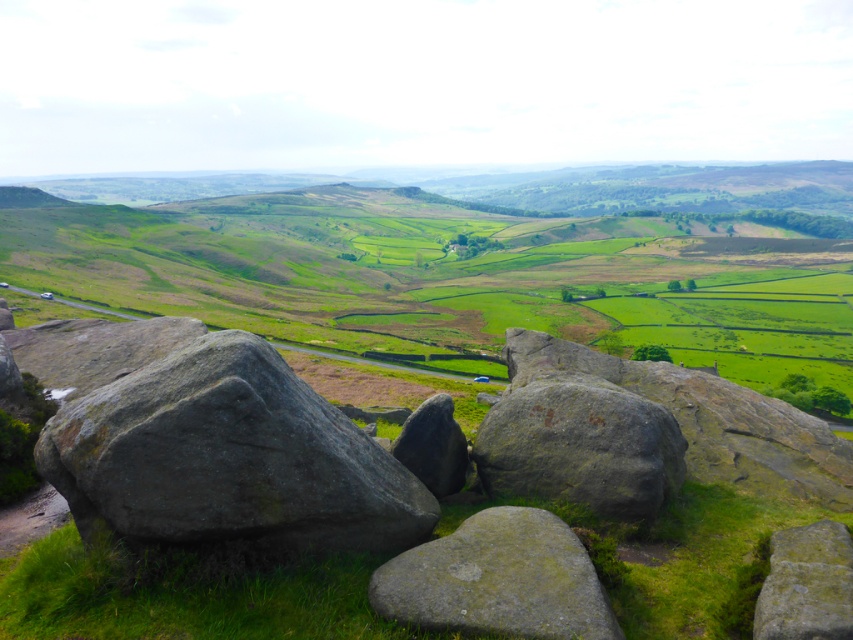
Question: Can you confirm if green mossy rock at center is thinner than green mossy rock at lower right?

Choices:
 (A) no
 (B) yes

Answer: (A)

Question: Which of these objects is positioned farthest from the green mossy rock at center?

Choices:
 (A) smooth gray rock at center
 (B) rough gray rock at center
 (C) gray rough rock at center
 (D) green grassy field at center

Answer: (D)

Question: Is green mossy rock at lower right above smooth gray rock at center?

Choices:
 (A) no
 (B) yes

Answer: (A)

Question: Which is nearer to the gray rough rock at center?

Choices:
 (A) smooth gray rock at center
 (B) green grassy field at center
 (C) green mossy rock at lower right

Answer: (A)

Question: Can you confirm if green grassy field at center is positioned above gray rough rock at center?

Choices:
 (A) no
 (B) yes

Answer: (B)

Question: Based on their relative distances, which object is nearer to the smooth gray rock at center?

Choices:
 (A) green mossy rock at center
 (B) green grassy field at center
 (C) rough gray rock at center
 (D) gray rough rock at center

Answer: (D)